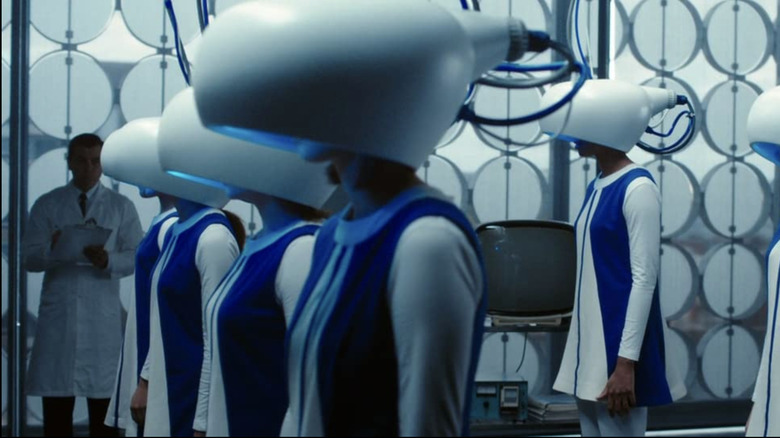
Locate an element on the screen. This screenshot has height=438, width=780. television is located at coordinates (533, 280).